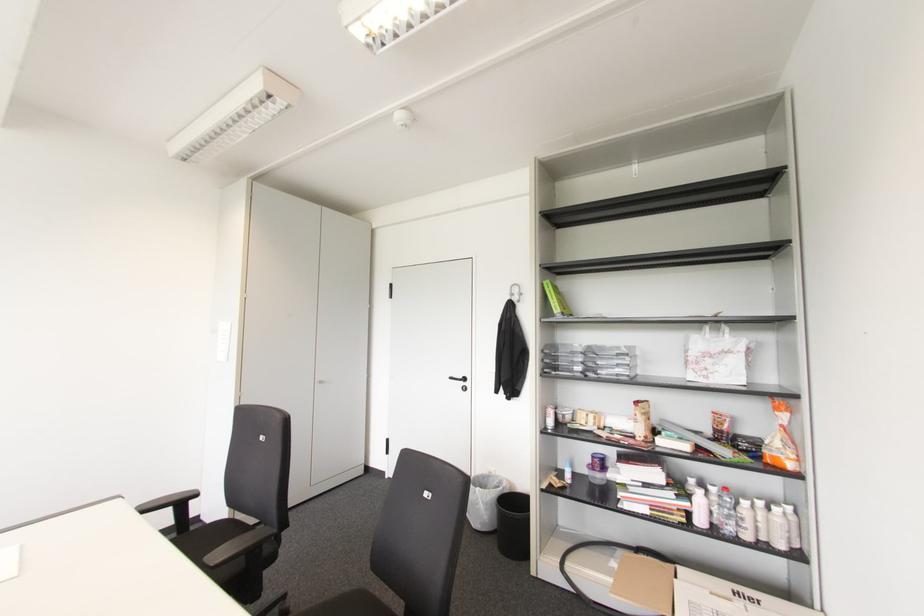
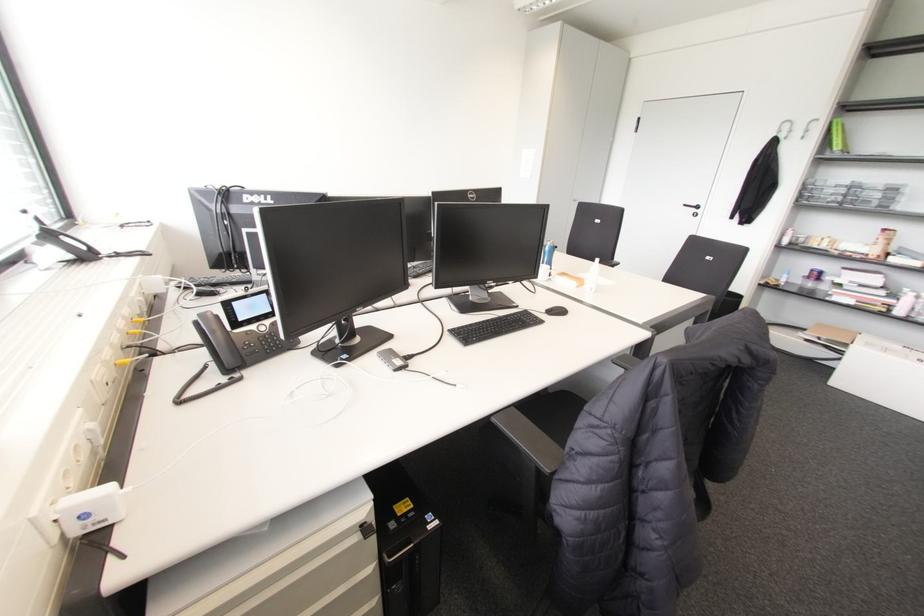
Question: I am providing you with two images of the same scene from different viewpoints. Which of the following objects are not visible in image2?

Choices:
 (A) white spray bottle
 (B) chair sitting surface
 (C) black keyboard
 (D) silver zipper pull

Answer: (B)